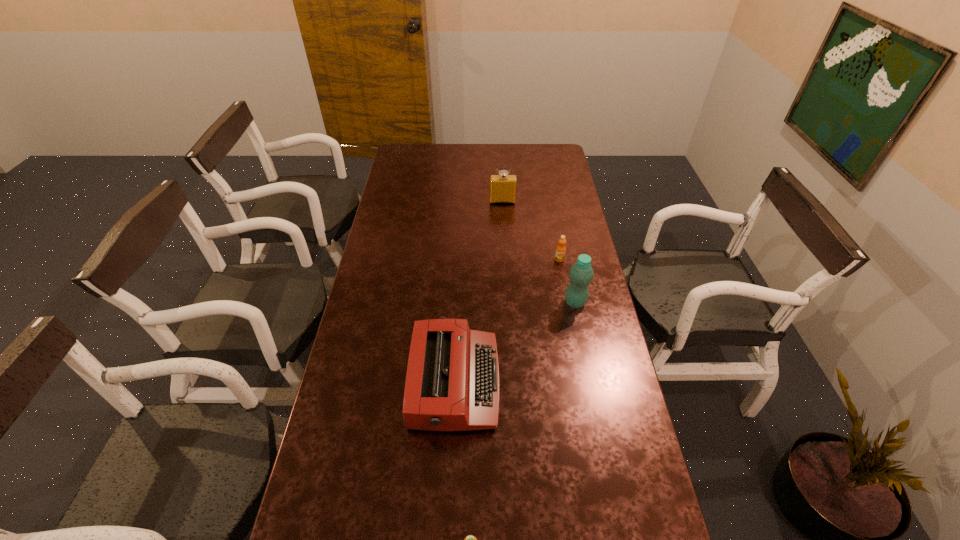
You are a GUI agent. You are given a task and a screenshot of the screen. Output one action in this format:
    pyautogui.click(x=<x>, y=<y>)
    Task: Click on the free space between the second nearest object and the second farthest object
    Image resolution: width=960 pixels, height=540 pixels.
    Given the screenshot: What is the action you would take?
    pyautogui.click(x=507, y=321)

This screenshot has width=960, height=540. What are the coordinates of `vacant space in between the fourth nearest object and the typewriter` in the screenshot? It's located at (507, 321).

Identify the location of free space between the farther orange juice and the farthest object. (531, 230).

At what (x,y) coordinates should I click in order to perform the action: click on free space between the fourth farthest object and the third farthest object. Please return your answer as a coordinate pair (x, y). Looking at the image, I should click on (516, 342).

In order to click on vacant space that is in between the second nearest object and the second tallest object in this screenshot , I will do `click(479, 292)`.

The height and width of the screenshot is (540, 960). Identify the location of unoccupied area between the second farthest object and the typewriter. (507, 321).

Where is `empty space that is in between the water bottle and the right orange juice`? empty space that is in between the water bottle and the right orange juice is located at coordinates (567, 281).

Identify which object is the third nearest to the fourth farthest object. Please provide its 2D coordinates. Your answer should be formatted as a tuple, i.e. [(x, y)], where the tuple contains the x and y coordinates of a point satisfying the conditions above.

[(561, 249)]

Locate which object ranks in proximity to the farther orange juice. Please provide its 2D coordinates. Your answer should be formatted as a tuple, i.e. [(x, y)], where the tuple contains the x and y coordinates of a point satisfying the conditions above.

[(581, 273)]

The image size is (960, 540). Find the location of `vacant space that satisfies the following two spatial constraints: 1. on the front label of the right orange juice; 2. on the typing side of the second nearest object`. vacant space that satisfies the following two spatial constraints: 1. on the front label of the right orange juice; 2. on the typing side of the second nearest object is located at coordinates (583, 382).